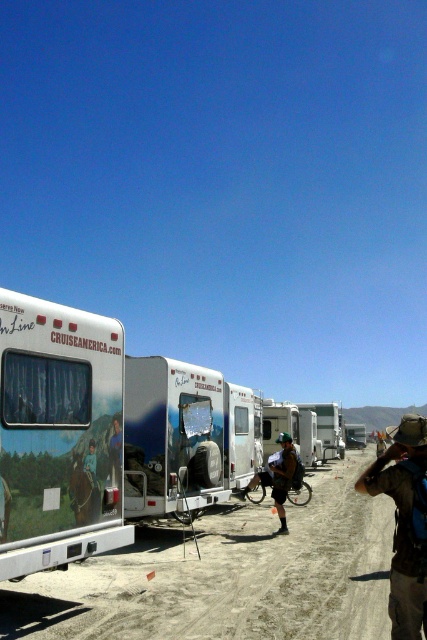
Question: In this image, where is camouflage fabric backpack at center located relative to white plastic camper at center?

Choices:
 (A) left
 (B) right

Answer: (A)

Question: Is dirt track at center bigger than white glossy recreational vehicle at left?

Choices:
 (A) no
 (B) yes

Answer: (B)

Question: Which point is farther from the camera taking this photo?

Choices:
 (A) (90, 477)
 (B) (335, 445)
 (C) (397, 540)

Answer: (B)

Question: Which of the following is the closest to the observer?

Choices:
 (A) (22, 296)
 (B) (283, 448)
 (C) (84, 468)

Answer: (A)

Question: Which object is positioned farthest from the dirt track at center?

Choices:
 (A) brown fabric hat at lower right
 (B) camouflage fabric backpack at center
 (C) white plastic camper at center

Answer: (C)

Question: Is dirt track at center above camouflage fabric backpack at center?

Choices:
 (A) no
 (B) yes

Answer: (A)